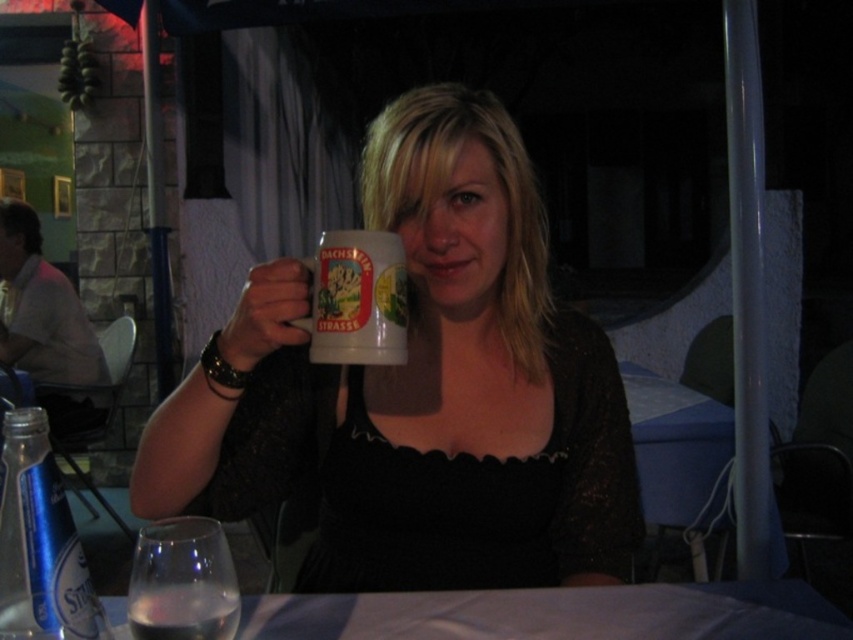
Based on the photo, you are a photographer setting up a shot of the scene described. The woman is holding a ceramic mug labeled BACHSTRETTEN STRASSE, and there is a transparent glass at lower left. To ensure the glass doesn not block the mug in the final photo, where should you position the glass relative to the mug?

The transparent glass at lower left is located at point (183, 580), so you should position it to the side or behind the mug to avoid blocking it in the photo.

You are standing in front of the table where the woman is sitting. You want to place your phone at the point marked as point (321,440). Considering the distance between you and that point, will you need to reach across the table to place your phone there?

The point (321,440) is 3.33 feet away from you. Since the table is between you and the point, you would need to reach across the table to place your phone there.

From the picture: You are a photographer trying to capture the best shot of the scene. You notice two points in the image at coordinates point [260,460] and point [271,595]. Which point is closer to the camera?

Point [260,460] is closer to the camera than point [271,595] because it is further to the camera than the latter according to the description.